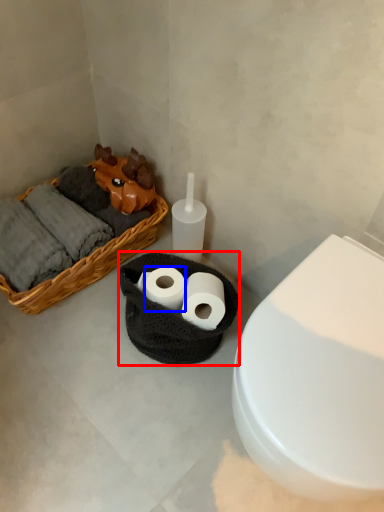
Question: Among these objects, which one is farthest to the camera, basket container (highlighted by a red box) or toilet paper (highlighted by a blue box)?

Choices:
 (A) basket container
 (B) toilet paper

Answer: (B)